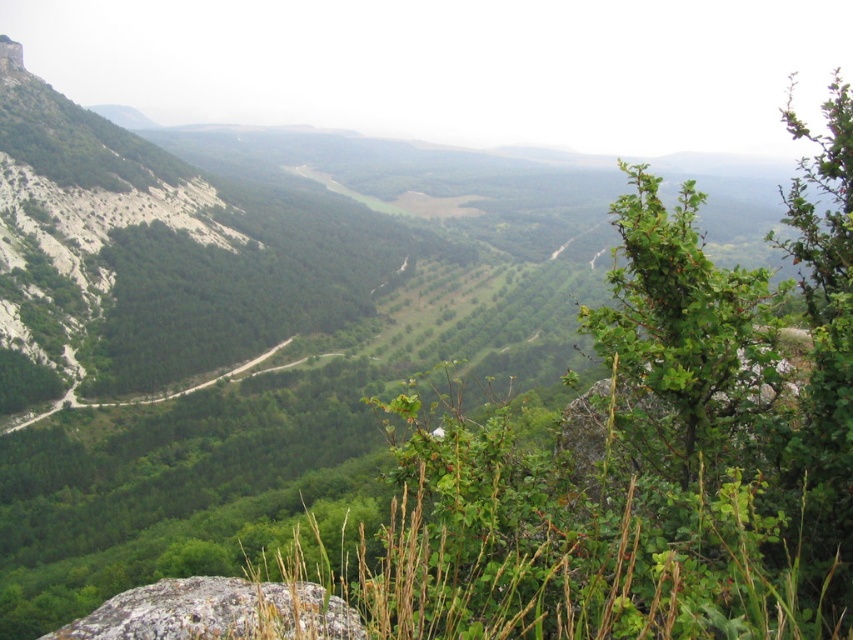
Question: Can you confirm if gray rough rock at lower left is wider than smooth rock peak at upper left?

Choices:
 (A) no
 (B) yes

Answer: (B)

Question: Which point appears farthest from the camera in this image?

Choices:
 (A) (4, 72)
 (B) (165, 636)

Answer: (A)

Question: Can you confirm if gray rough rock at lower left is positioned above smooth rock peak at upper left?

Choices:
 (A) no
 (B) yes

Answer: (A)

Question: Is gray rough rock at lower left wider than smooth rock peak at upper left?

Choices:
 (A) no
 (B) yes

Answer: (B)

Question: Among these objects, which one is nearest to the camera?

Choices:
 (A) gray rough rock at lower left
 (B) smooth rock peak at upper left

Answer: (A)